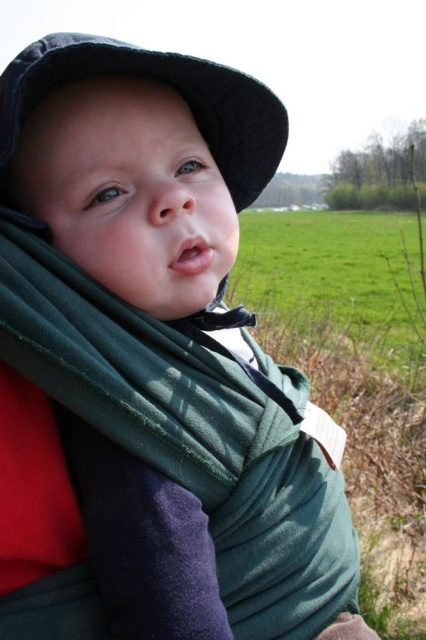
Where is the green grass field at center located in the image?

The green grass field at center is located at point (339, 278) in the image.

Based on the photo, you are a photographer setting up a shot of the baby in the green wrap carrier. You want to ensure the green grass field at center and the black fabric hat at upper left are both visible in the frame. Which object should you adjust your focus to prioritize to ensure both are in the same plane of focus?

The green grass field at center should be prioritized because it is closer to the camera than the black fabric hat at upper left, ensuring both will be in focus when focusing on the closer object.

You are standing in the image and want to walk towards the green grass field at center. Which direction should you head relative to the black fabric hat at upper left?

The green grass field at center is to the right of the black fabric hat at upper left, so you should head to the right of the black fabric hat at upper left to reach the green grass field at center.